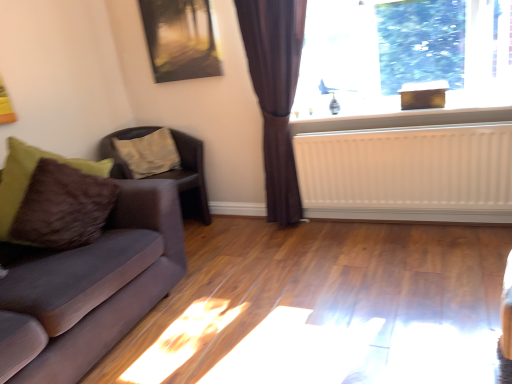
Question: Is brown leather chair at left positioned with its back to white matte radiator at upper right?

Choices:
 (A) yes
 (B) no

Answer: (B)

Question: Considering the relative positions of brown leather chair at left and white matte radiator at upper right in the image provided, is brown leather chair at left to the right of white matte radiator at upper right from the viewer's perspective?

Choices:
 (A) no
 (B) yes

Answer: (A)

Question: From a real-world perspective, is brown leather chair at left positioned under white matte radiator at upper right based on gravity?

Choices:
 (A) no
 (B) yes

Answer: (A)

Question: Are brown leather chair at left and white matte radiator at upper right making contact?

Choices:
 (A) no
 (B) yes

Answer: (A)

Question: Is brown leather chair at left not inside white matte radiator at upper right?

Choices:
 (A) yes
 (B) no

Answer: (A)

Question: Is brown leather chair at left closer to camera compared to white matte radiator at upper right?

Choices:
 (A) no
 (B) yes

Answer: (A)

Question: Are white painted wood at upper right and brown leather chair at left beside each other?

Choices:
 (A) no
 (B) yes

Answer: (A)

Question: Does white painted wood at upper right appear on the left side of brown leather chair at left?

Choices:
 (A) yes
 (B) no

Answer: (B)

Question: From the image's perspective, is white painted wood at upper right beneath brown leather chair at left?

Choices:
 (A) yes
 (B) no

Answer: (B)

Question: Would you say white painted wood at upper right is outside brown leather chair at left?

Choices:
 (A) yes
 (B) no

Answer: (A)

Question: From a real-world perspective, is white painted wood at upper right under brown leather chair at left?

Choices:
 (A) yes
 (B) no

Answer: (B)

Question: Considering the relative sizes of white painted wood at upper right and brown leather chair at left in the image provided, is white painted wood at upper right wider than brown leather chair at left?

Choices:
 (A) yes
 (B) no

Answer: (B)

Question: From the image's perspective, is white painted wood at upper right located beneath metallic reflective painting at upper center?

Choices:
 (A) no
 (B) yes

Answer: (B)